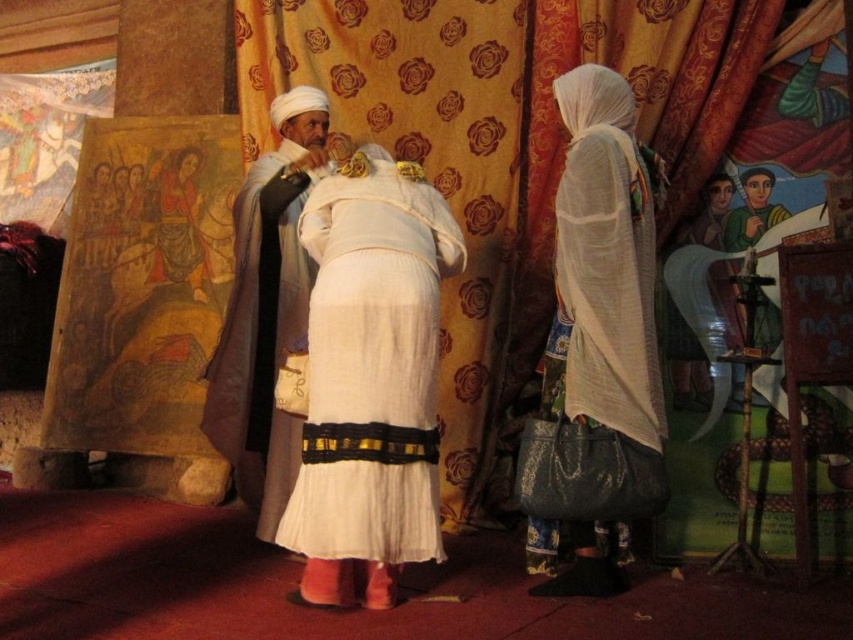
Question: Is white cotton dress at center smaller than matte white robe at center?

Choices:
 (A) yes
 (B) no

Answer: (B)

Question: Among these points, which one is farthest from the camera?

Choices:
 (A) (421, 1)
 (B) (242, 250)

Answer: (A)

Question: Which point is closer to the camera taking this photo?

Choices:
 (A) (392, 26)
 (B) (299, 156)
 (C) (763, 196)

Answer: (C)

Question: Does white sheer fabric at center have a smaller size compared to green fabric figure at upper right?

Choices:
 (A) yes
 (B) no

Answer: (B)

Question: Which of these objects is positioned closest to the white silk robe at center?

Choices:
 (A) white cotton dress at center
 (B) yellow floral fabric at center
 (C) matte white robe at center

Answer: (A)

Question: Is white sheer fabric at center bigger than matte white robe at center?

Choices:
 (A) yes
 (B) no

Answer: (A)